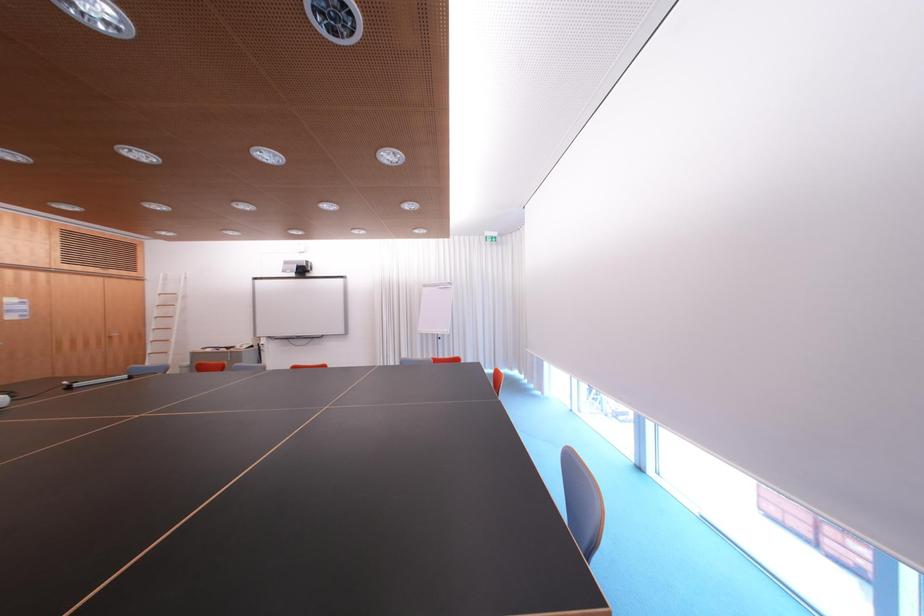
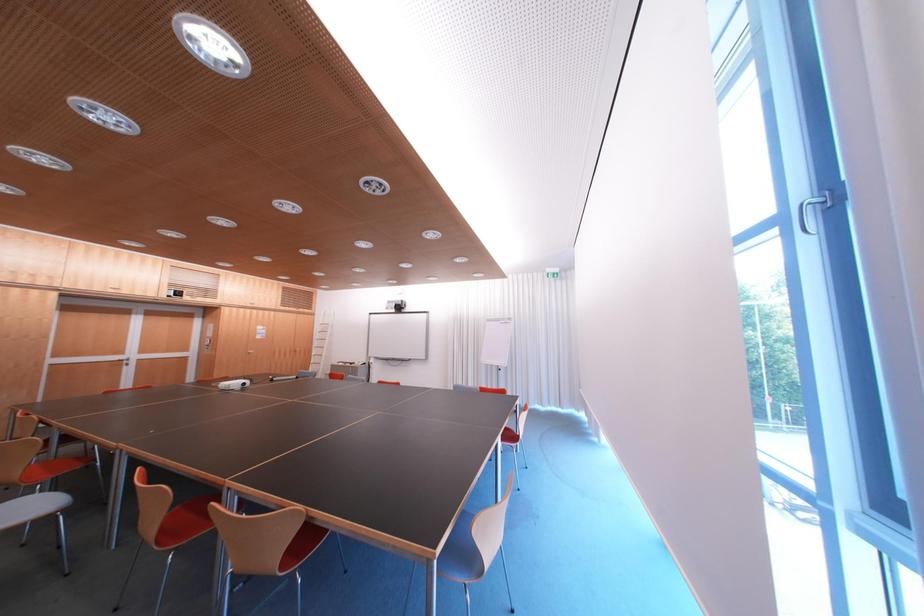
Question: The camera is either moving clockwise (left) or counter-clockwise (right) around the object. The first image is from the beginning of the video and the second image is from the end. Is the camera moving left or right when shooting the video?

Choices:
 (A) Left
 (B) Right

Answer: (B)